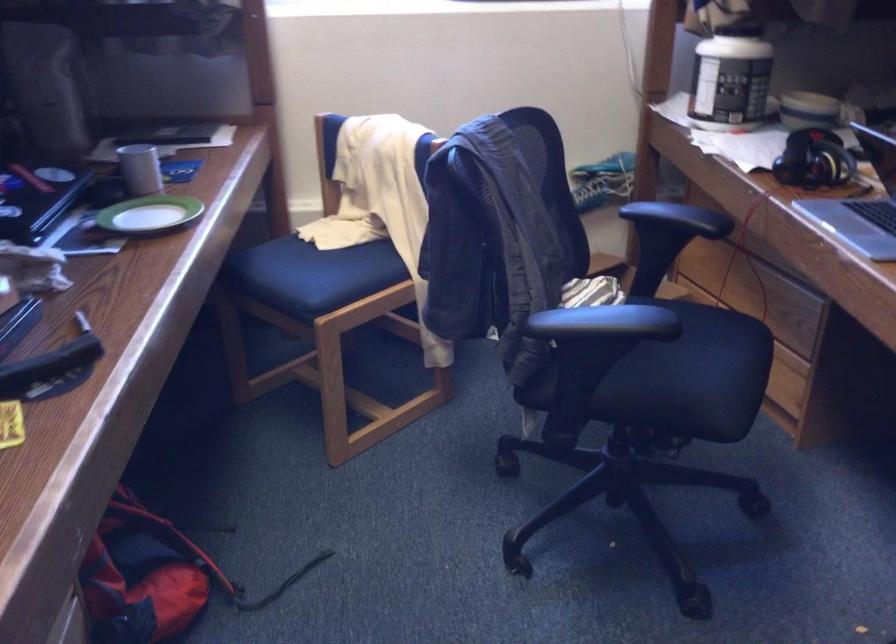
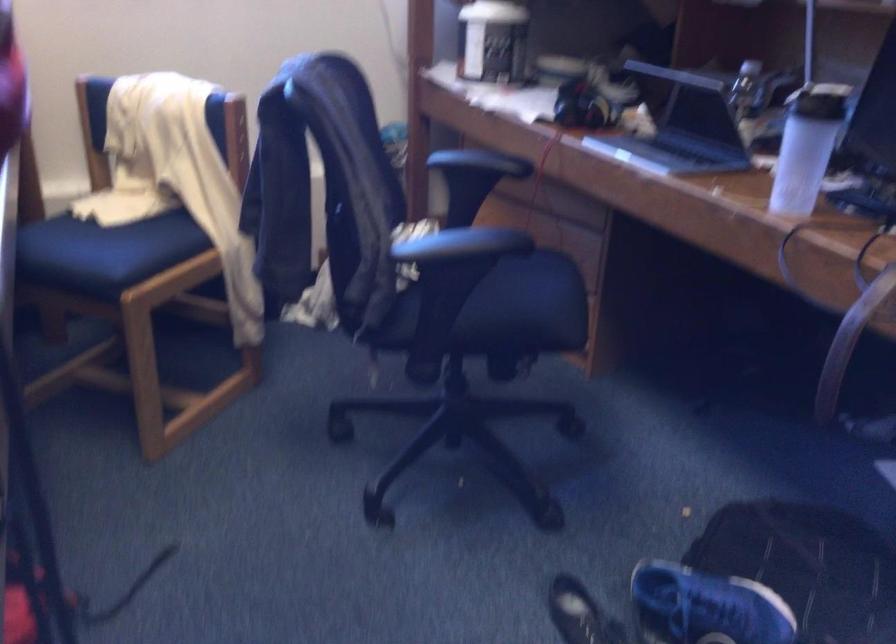
Locate, in the second image, the point that corresponds to the point at 666,386 in the first image.

(515, 313)